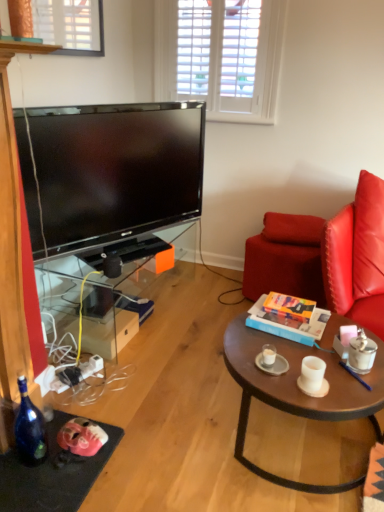
This screenshot has height=512, width=384. Find the location of `vacant area to the right of white matte coffee cup at center right, placed as the 2th coffee cup when sorted from right to left`. vacant area to the right of white matte coffee cup at center right, placed as the 2th coffee cup when sorted from right to left is located at coordinates (349, 378).